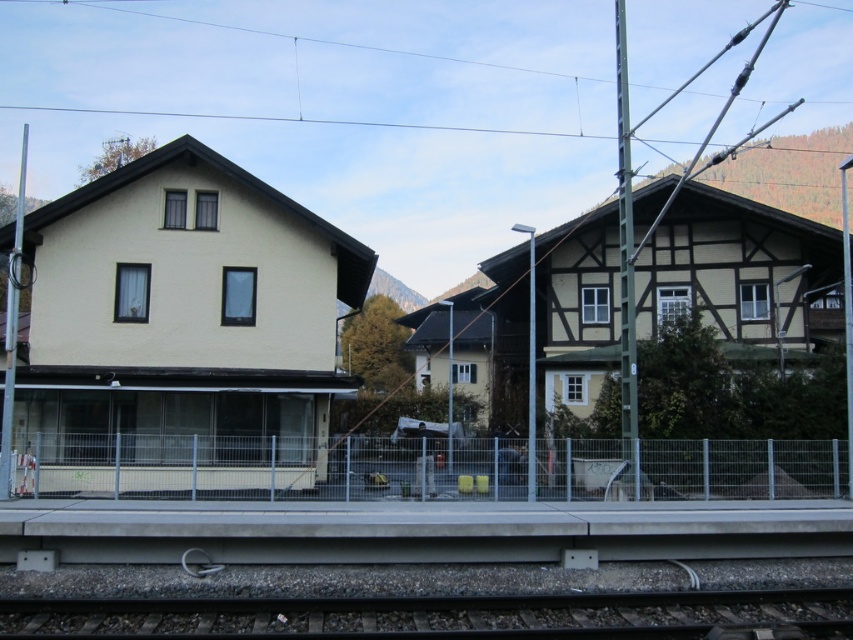
You are a photographer planning to capture a wide shot of the matte yellow building at center and the gray metal rail at center. Based on their sizes, which object should you focus on first to ensure both are in frame?

The matte yellow building at center is bigger than the gray metal rail at center, so you should focus on the matte yellow building at center first to ensure both are in frame.

You are a delivery drone that needs to deliver a package to the matte yellow building at center. The drone has a maximum flight range of 40 feet. Can you safely deliver the package without landing on the smooth metal train track at lower center?

The matte yellow building at center and smooth metal train track at lower center are 37.21 feet apart. Since the drone can fly 40 feet, it can reach the matte yellow building at center without landing on the track.

You are a landscape architect designing a new garden between the matte yellow building at center and the smooth metal train track at lower center. The garden must be wide enough to accommodate a 3m wide pathway. Can the space between them support this pathway?

The matte yellow building at center is narrower than the smooth metal train track at lower center, but the description only mentions their widths relative to each other. Without specific measurements, we cannot confirm if the space between them is at least 3 meters wide. Additional information about the actual widths or distance between them is needed to determine feasibility.